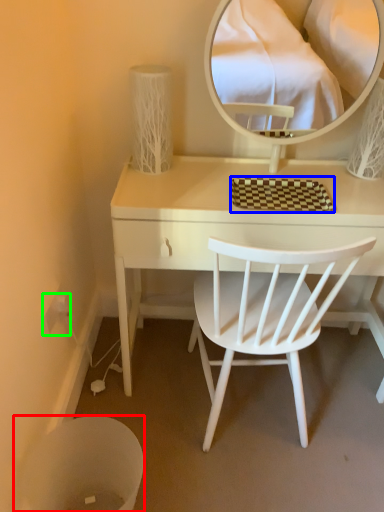
Question: Considering the real-world distances, which object is farthest from trash bin/can (highlighted by a red box)? mat (highlighted by a blue box) or power outlet (highlighted by a green box)?

Choices:
 (A) mat
 (B) power outlet

Answer: (A)